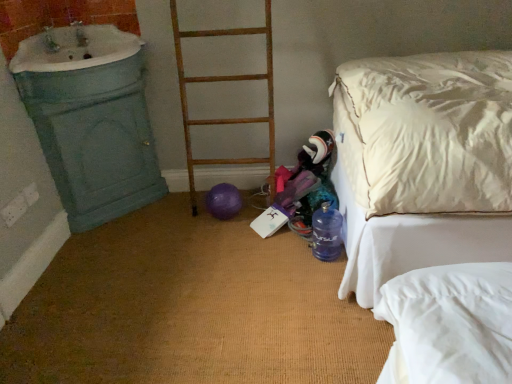
This screenshot has height=384, width=512. Find the location of `free space to the left of translucent blue bottle at lower right`. free space to the left of translucent blue bottle at lower right is located at coordinates (288, 254).